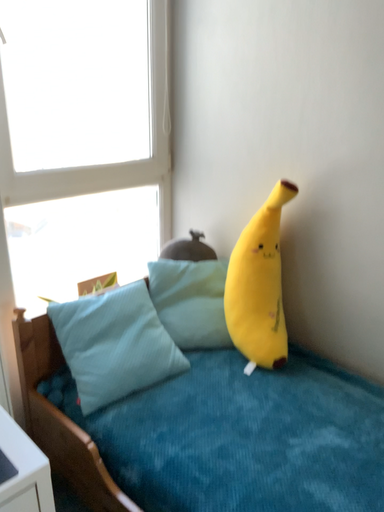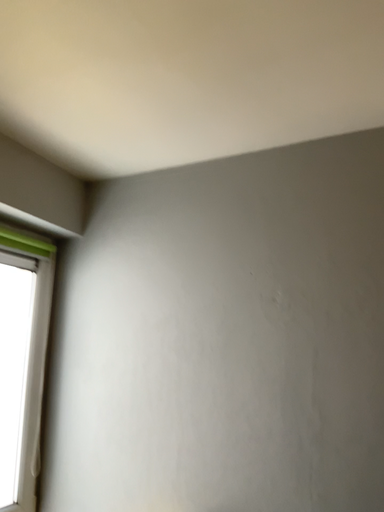
Question: How did the camera likely rotate when shooting the video?

Choices:
 (A) rotated downward
 (B) rotated upward

Answer: (B)